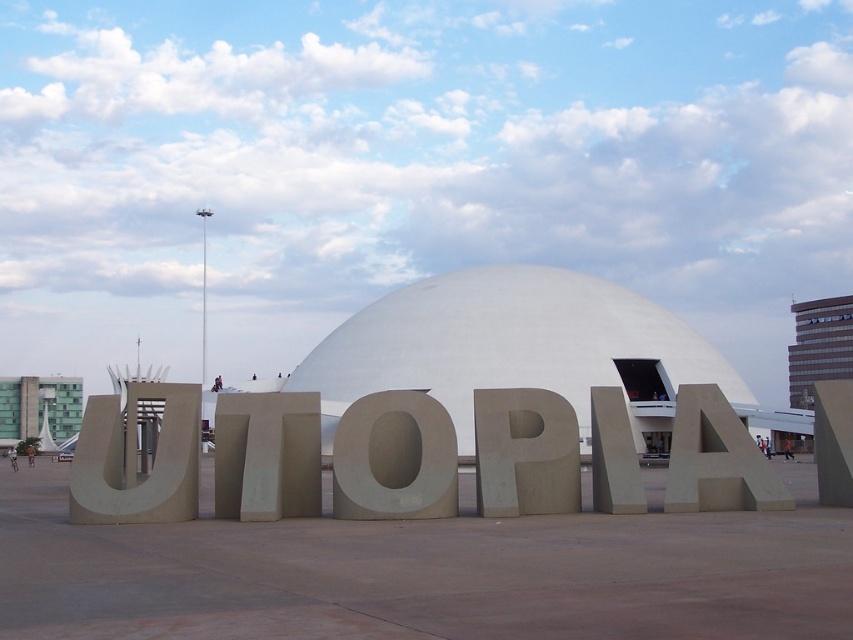
Question: Can you confirm if concrete letter o at center is positioned to the left of gray concrete letter at center?

Choices:
 (A) yes
 (B) no

Answer: (A)

Question: Which point is farther from the camera taking this photo?

Choices:
 (A) (276, 476)
 (B) (579, 449)

Answer: (B)

Question: Among these points, which one is nearest to the camera?

Choices:
 (A) (357, 497)
 (B) (601, 477)
 (C) (280, 467)

Answer: (A)

Question: Does gray concrete letter u at center appear on the left side of concrete letter o at center?

Choices:
 (A) yes
 (B) no

Answer: (A)

Question: In this image, where is concrete letter o at center located relative to matte gray letter p at center?

Choices:
 (A) above
 (B) below

Answer: (A)

Question: Considering the real-world distances, which object is closest to the white smooth dome at center?

Choices:
 (A) matte concrete letter a at center
 (B) gray concrete letter t at center

Answer: (B)